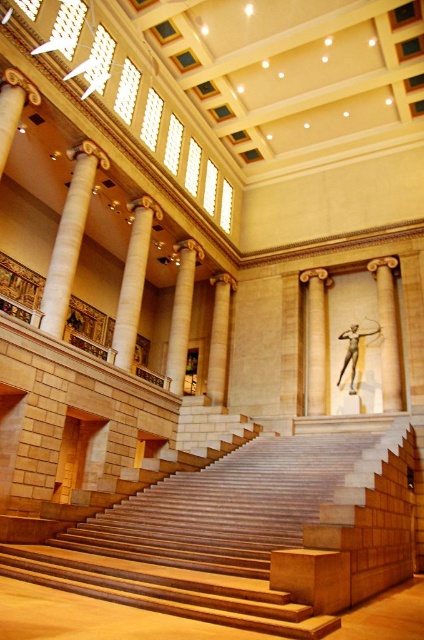
Question: In this image, where is beige stone column at center located relative to bronze statue at center?

Choices:
 (A) below
 (B) above

Answer: (B)

Question: Which point is closer to the camera taking this photo?

Choices:
 (A) (173, 294)
 (B) (136, 296)
 (C) (345, 364)
 (D) (384, 340)

Answer: (B)

Question: Based on their relative distances, which object is nearer to the beige marble column at center?

Choices:
 (A) wooden stairs at center
 (B) bronze statue at center
 (C) smooth stone column at center
 (D) beige stone column at center

Answer: (D)

Question: Does white marble column at center come behind beige stone column at center?

Choices:
 (A) no
 (B) yes

Answer: (A)

Question: Can you confirm if white marble column at center is smaller than bronze statue at center?

Choices:
 (A) yes
 (B) no

Answer: (B)

Question: Which of these objects is positioned farthest from the beige marble column at center?

Choices:
 (A) white marble column at center
 (B) wooden stairs at center
 (C) beige stone column at center
 (D) smooth stone column at center

Answer: (B)